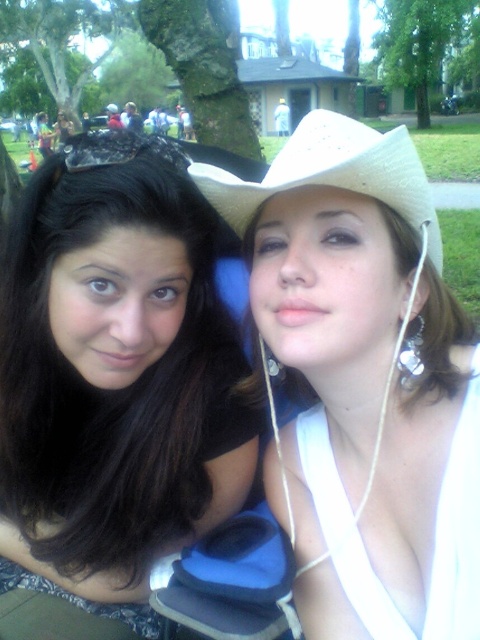
Question: Which point is farther to the camera?

Choices:
 (A) (403, 456)
 (B) (196, 445)

Answer: (B)

Question: Does white matte cowboy hat at upper right have a greater width compared to black matte hair at center?

Choices:
 (A) no
 (B) yes

Answer: (A)

Question: Among these points, which one is nearest to the camera?

Choices:
 (A) (360, 627)
 (B) (67, 193)
 (C) (389, 200)

Answer: (C)

Question: Does black matte hair at center lie in front of white straw cowboy hat at upper right?

Choices:
 (A) no
 (B) yes

Answer: (A)

Question: Can you confirm if black matte hair at center is positioned to the left of white straw cowboy hat at upper right?

Choices:
 (A) no
 (B) yes

Answer: (B)

Question: Which point appears farthest from the camera in this image?

Choices:
 (A) (403, 129)
 (B) (432, 408)
 (C) (178, 502)

Answer: (C)